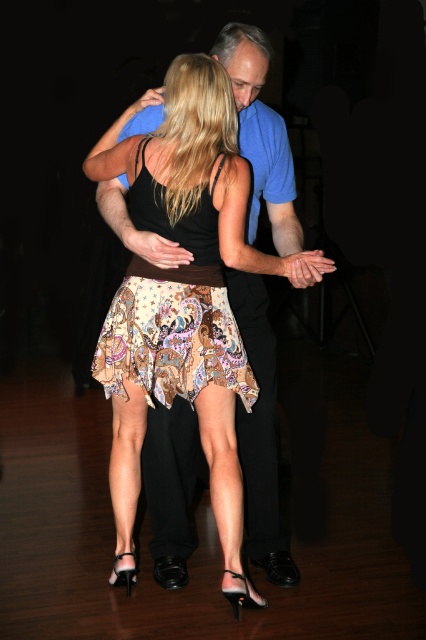
Which is above, printed fabric skirt at center or paisley-patterned skirt at center?

Positioned higher is paisley-patterned skirt at center.

Is point (222, 212) more distant than point (160, 368)?

No, (222, 212) is closer to viewer.

Where is `printed fabric skirt at center`? The height and width of the screenshot is (640, 426). printed fabric skirt at center is located at coordinates (192, 157).